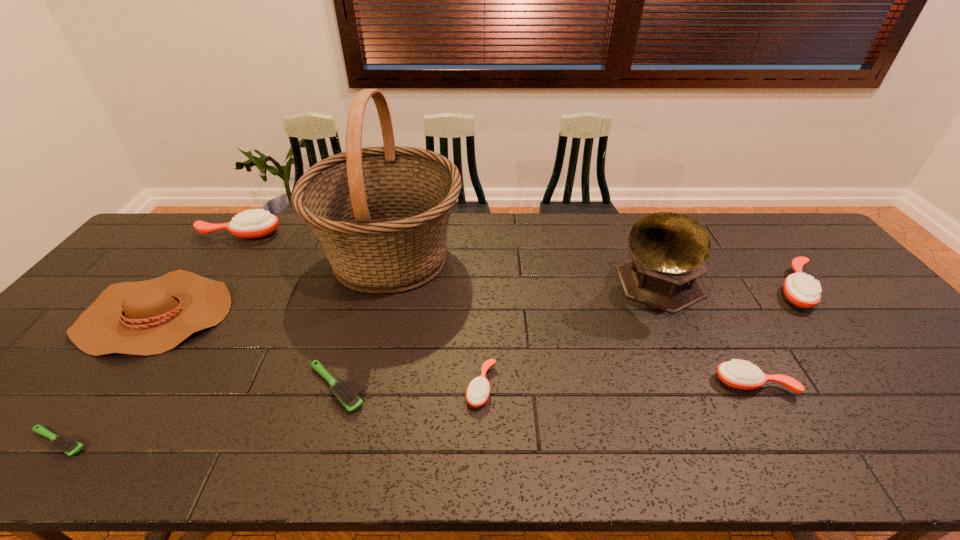
Identify which orange hairbrush is the second closest to the third biggest orange hairbrush. Please provide its 2D coordinates. Your answer should be formatted as a tuple, i.e. [(x, y)], where the tuple contains the x and y coordinates of a point satisfying the conditions above.

[(478, 391)]

The height and width of the screenshot is (540, 960). Identify the location of the closest orange hairbrush to the farthest hairbrush. (478, 391).

You are a GUI agent. You are given a task and a screenshot of the screen. Output one action in this format:
    pyautogui.click(x=<x>, y=<y>)
    Task: Click on the vacant space that satisfies the following two spatial constraints: 1. on the horn direction of the third biggest orange hairbrush; 2. on the left side of the phonograph record
    
    Given the screenshot: What is the action you would take?
    pyautogui.click(x=698, y=383)